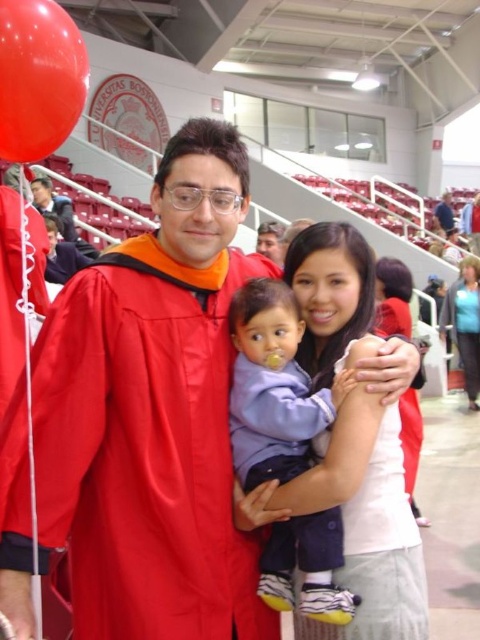
Does white cotton shirt at center have a smaller size compared to matte black graduation gown at center?

Yes, white cotton shirt at center is smaller than matte black graduation gown at center.

Who is more distant from viewer, (286,497) or (257,244)?

The point (257,244) is behind.

Between point (404, 614) and point (278, 221), which one is positioned in front?

Point (404, 614)

Where is `white cotton shirt at center`? white cotton shirt at center is located at coordinates (356, 442).

Is point (475, 362) less distant than point (451, 216)?

Yes, point (475, 362) is closer to viewer.

Is point (477, 342) more distant than point (442, 228)?

No, it is not.

Who is more forward, (467, 381) or (446, 209)?

Point (467, 381) is in front.

Locate an element on the screen. This screenshot has height=640, width=480. white fabric shirt at upper center is located at coordinates (465, 323).

Does white cotton shirt at center have a greater width compared to blue fabric shirt at upper right?

No.

Consider the image. Is white cotton shirt at center above blue fabric shirt at upper right?

Incorrect, white cotton shirt at center is not positioned above blue fabric shirt at upper right.

The width and height of the screenshot is (480, 640). What are the coordinates of `white cotton shirt at center` in the screenshot? It's located at (356, 442).